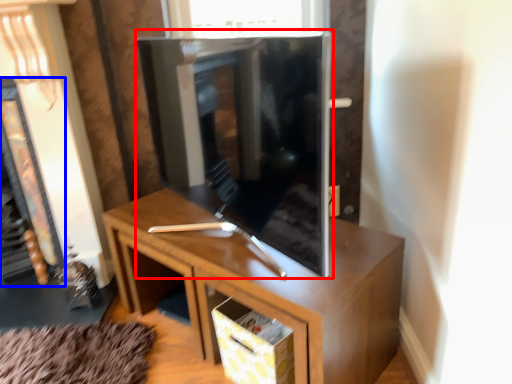
Question: Which object is further to the camera taking this photo, tv cabinet (highlighted by a red box) or fireplace (highlighted by a blue box)?

Choices:
 (A) tv cabinet
 (B) fireplace

Answer: (B)